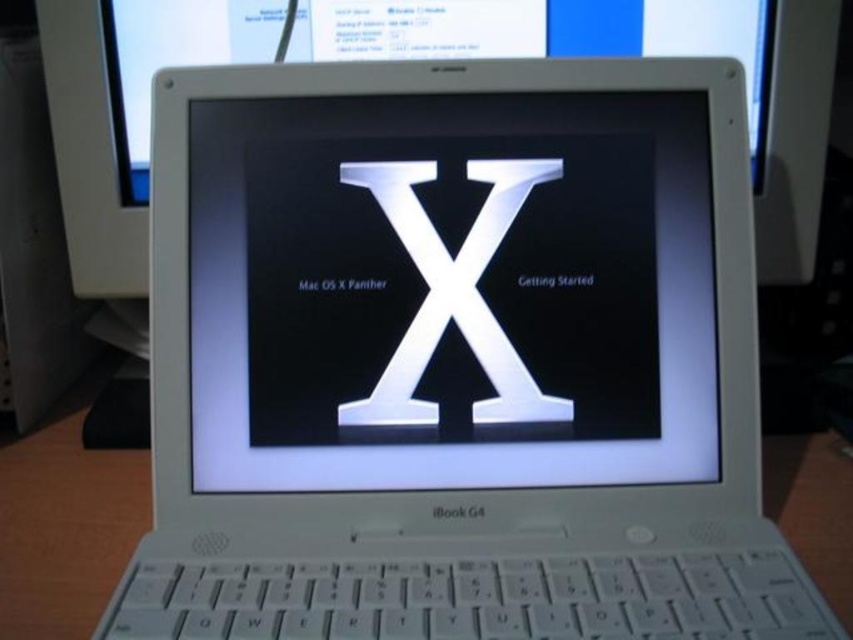
Question: Is white glossy monitor at center thinner than metallic silver letter x at center?

Choices:
 (A) no
 (B) yes

Answer: (A)

Question: Considering the relative positions of white glossy monitor at center and metallic silver letter x at center in the image provided, where is white glossy monitor at center located with respect to metallic silver letter x at center?

Choices:
 (A) above
 (B) below

Answer: (A)

Question: Which of the following is the closest to the observer?

Choices:
 (A) (468, 296)
 (B) (135, 520)
 (C) (453, 108)
 (D) (701, 3)

Answer: (A)

Question: Which point is farther to the camera?

Choices:
 (A) white glossy monitor at center
 (B) white plastic keyboard at center
 (C) metallic silver letter x at center
 (D) white glossy x at center

Answer: (A)

Question: Estimate the real-world distances between objects in this image. Which object is closer to the white plastic keyboard at center?

Choices:
 (A) metallic silver letter x at center
 (B) white glossy x at center
 (C) white glossy monitor at center

Answer: (A)

Question: From the image, what is the correct spatial relationship of white plastic keyboard at center in relation to metallic silver letter x at center?

Choices:
 (A) right
 (B) left

Answer: (B)